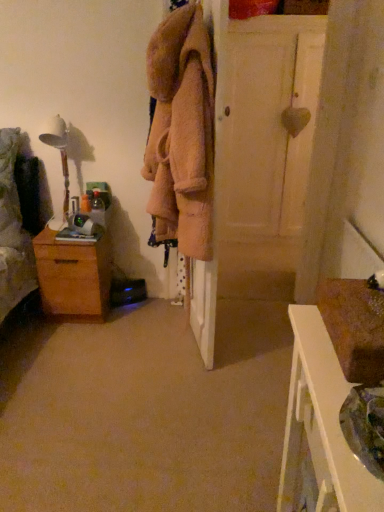
At what (x,y) coordinates should I click in order to perform the action: click on wooden table lamp at left. Please return your answer as a coordinate pair (x, y). Looking at the image, I should click on (60, 156).

Describe the element at coordinates (74, 275) in the screenshot. This screenshot has height=512, width=384. I see `wooden chest of drawers at left` at that location.

Measure the distance between point (296, 483) and camera.

Point (296, 483) is 1.30 meters from camera.

Where is `fuzzy beige coat at center`? fuzzy beige coat at center is located at coordinates (181, 132).

Would you consider wooden table lamp at left to be distant from white wood nightstand at lower right?

Yes, wooden table lamp at left and white wood nightstand at lower right are quite far apart.

Can you confirm if wooden table lamp at left is wider than white wood nightstand at lower right?

Incorrect, the width of wooden table lamp at left does not surpass that of white wood nightstand at lower right.

Does wooden table lamp at left appear on the right side of white wood nightstand at lower right?

No, wooden table lamp at left is not to the right of white wood nightstand at lower right.

From the image's perspective, which is above, wooden table lamp at left or white wood nightstand at lower right?

wooden table lamp at left appears higher in the image.

How many degrees apart are the facing directions of white matte door at center and white wood nightstand at lower right?

They differ by 89.2 degrees in their facing directions.

Does white matte door at center turn towards white wood nightstand at lower right?

Yes, white matte door at center is oriented towards white wood nightstand at lower right.

Which is more to the right, white matte door at center or white wood nightstand at lower right?

white matte door at center.

From a real-world perspective, between white matte door at center and white wood nightstand at lower right, who is vertically higher?

In real-world perspective, white matte door at center is above.

Could you tell me if fuzzy beige coat at center is turned towards wooden chest of drawers at left?

Yes, fuzzy beige coat at center is oriented towards wooden chest of drawers at left.

Would you say fuzzy beige coat at center is inside or outside wooden chest of drawers at left?

fuzzy beige coat at center is outside wooden chest of drawers at left.

From a real-world perspective, between fuzzy beige coat at center and wooden chest of drawers at left, who is vertically higher?

fuzzy beige coat at center is physically above.

From the image's perspective, which is below, fuzzy beige coat at center or wooden chest of drawers at left?

wooden chest of drawers at left is shown below in the image.

Could you tell me if wooden table lamp at left is facing white matte door at center?

No.

Is wooden table lamp at left far away from white matte door at center?

That's right, there is a large distance between wooden table lamp at left and white matte door at center.

Is white matte door at center completely or partially inside wooden table lamp at left?

No, white matte door at center is located outside of wooden table lamp at left.

Who is shorter, fuzzy beige coat at center or white matte door at center?

Standing shorter between the two is fuzzy beige coat at center.

Is fuzzy beige coat at center not within white matte door at center?

Yes.

In terms of size, does fuzzy beige coat at center appear bigger or smaller than white matte door at center?

In the image, fuzzy beige coat at center appears to be smaller than white matte door at center.

Is fuzzy beige coat at center oriented towards white matte door at center?

No.

Which is behind, white wood nightstand at lower right or wooden table lamp at left?

wooden table lamp at left is further from the camera.

Is point (327, 494) in front of point (69, 192)?

Yes, it is.

In the scene shown: Is white wood nightstand at lower right not within wooden table lamp at left?

white wood nightstand at lower right is positioned outside wooden table lamp at left.

Between white wood nightstand at lower right and wooden table lamp at left, which one has larger size?

white wood nightstand at lower right.

Does white matte door at center appear on the left side of fuzzy beige coat at center?

In fact, white matte door at center is to the right of fuzzy beige coat at center.

Is white matte door at center beside fuzzy beige coat at center?

No, white matte door at center is not touching fuzzy beige coat at center.

Is fuzzy beige coat at center completely or partially inside white matte door at center?

→ Actually, fuzzy beige coat at center is outside white matte door at center.

Considering the relative sizes of white matte door at center and fuzzy beige coat at center in the image provided, is white matte door at center thinner than fuzzy beige coat at center?

In fact, white matte door at center might be wider than fuzzy beige coat at center.

At what (x,y) coordinates should I click in order to perform the action: click on table lamp behind the white wood nightstand at lower right. Please return your answer as a coordinate pair (x, y). This screenshot has width=384, height=512. Looking at the image, I should click on (60, 156).

Where is `door that appears above the white wood nightstand at lower right (from the image's perspective)`? This screenshot has height=512, width=384. door that appears above the white wood nightstand at lower right (from the image's perspective) is located at coordinates (x=267, y=123).

Based on their spatial positions, is fuzzy beige coat at center or wooden table lamp at left closer to wooden chest of drawers at left?

wooden table lamp at left.

When comparing their distances from white matte door at center, does wooden table lamp at left or wooden chest of drawers at left seem further?

Among the two, wooden chest of drawers at left is located further to white matte door at center.

From the picture: Based on their spatial positions, is wooden table lamp at left or white wood nightstand at lower right further from wooden chest of drawers at left?

Among the two, white wood nightstand at lower right is located further to wooden chest of drawers at left.

Considering their positions, is wooden chest of drawers at left positioned further to white matte door at center than fuzzy beige coat at center?

wooden chest of drawers at left is positioned further to the anchor white matte door at center.

Estimate the real-world distances between objects in this image. Which object is further from fuzzy beige coat at center, white wood nightstand at lower right or white matte door at center?

Among the two, white matte door at center is located further to fuzzy beige coat at center.

Considering their positions, is fuzzy beige coat at center positioned further to white wood nightstand at lower right than wooden chest of drawers at left?

wooden chest of drawers at left lies further to white wood nightstand at lower right than the other object.

Which object lies nearer to the anchor point wooden table lamp at left, white wood nightstand at lower right or fuzzy beige coat at center?

Based on the image, fuzzy beige coat at center appears to be nearer to wooden table lamp at left.

Looking at the image, which one is located closer to white matte door at center, white wood nightstand at lower right or fuzzy beige coat at center?

Based on the image, fuzzy beige coat at center appears to be nearer to white matte door at center.

Locate an element on the screen. clothing between wooden chest of drawers at left and white matte door at center from left to right is located at coordinates (181, 132).

Where is `clothing between wooden table lamp at left and white matte door at center`? The image size is (384, 512). clothing between wooden table lamp at left and white matte door at center is located at coordinates (181, 132).

You are a GUI agent. You are given a task and a screenshot of the screen. Output one action in this format:
    pyautogui.click(x=<x>, y=<y>)
    Task: Click on the chest of drawers between wooden table lamp at left and fuzzy beige coat at center
    
    Given the screenshot: What is the action you would take?
    pyautogui.click(x=74, y=275)

Find the location of a particular element. chest of drawers between white wood nightstand at lower right and white matte door at center along the z-axis is located at coordinates coord(74,275).